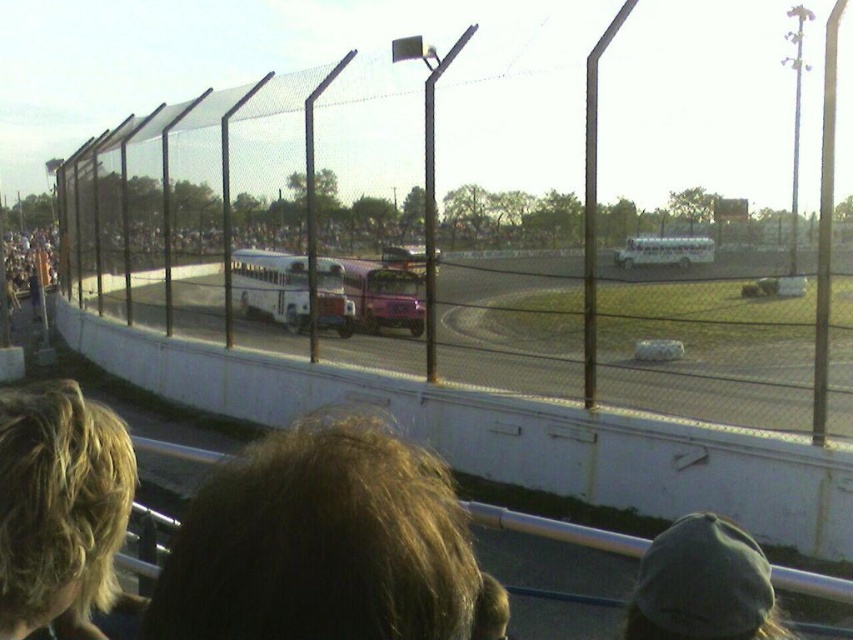
Describe the element at coordinates (59, 508) in the screenshot. This screenshot has width=853, height=640. I see `blonde hair at upper left` at that location.

Who is positioned more to the right, blonde hair at upper left or green fabric cap at lower right?

Positioned to the right is green fabric cap at lower right.

Does point (41, 582) come behind point (642, 608)?

No, (41, 582) is in front of (642, 608).

The height and width of the screenshot is (640, 853). Identify the location of blonde hair at upper left. (59, 508).

Can you confirm if metallic chain-link fence at center is shorter than blonde hair at upper left?

No.

Based on the photo, is metallic chain-link fence at center positioned at the back of blonde hair at upper left?

Yes, metallic chain-link fence at center is behind blonde hair at upper left.

What do you see at coordinates (514, 214) in the screenshot? I see `metallic chain-link fence at center` at bounding box center [514, 214].

Find the location of a particular element. The height and width of the screenshot is (640, 853). metallic chain-link fence at center is located at coordinates (514, 214).

Consider the image. Does metallic chain-link fence at center lie in front of green fabric cap at lower right?

No.

Is metallic chain-link fence at center positioned behind green fabric cap at lower right?

Yes.

Does point (372, 157) come farther from viewer compared to point (637, 604)?

Yes, it is.

Find the location of a particular element. metallic chain-link fence at center is located at coordinates (514, 214).